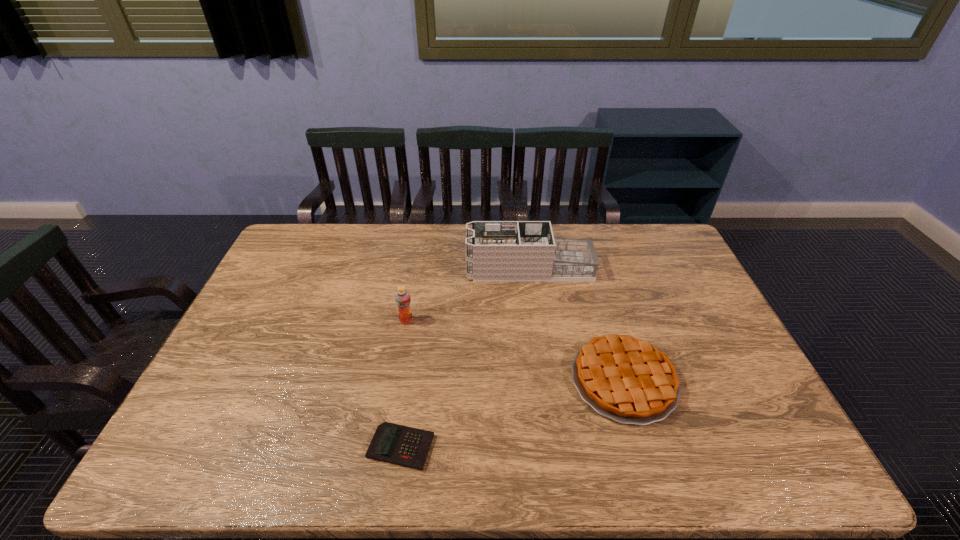
Locate an element on the screen. The width and height of the screenshot is (960, 540). vacant area in the image that satisfies the following two spatial constraints: 1. at the entrance of the second shortest object; 2. on the left side of the dollhouse is located at coordinates (544, 380).

I want to click on vacant space that satisfies the following two spatial constraints: 1. on the back side of the shortest object; 2. on the right side of the second shortest object, so click(x=410, y=380).

Find the location of a particular element. The image size is (960, 540). free space that satisfies the following two spatial constraints: 1. at the entrance of the dollhouse; 2. on the front side of the shortest object is located at coordinates (553, 447).

You are a GUI agent. You are given a task and a screenshot of the screen. Output one action in this format:
    pyautogui.click(x=<x>, y=<y>)
    Task: Click on the free location that satisfies the following two spatial constraints: 1. at the entrance of the dollhouse; 2. on the left side of the pie
    The image size is (960, 540).
    Given the screenshot: What is the action you would take?
    point(544,380)